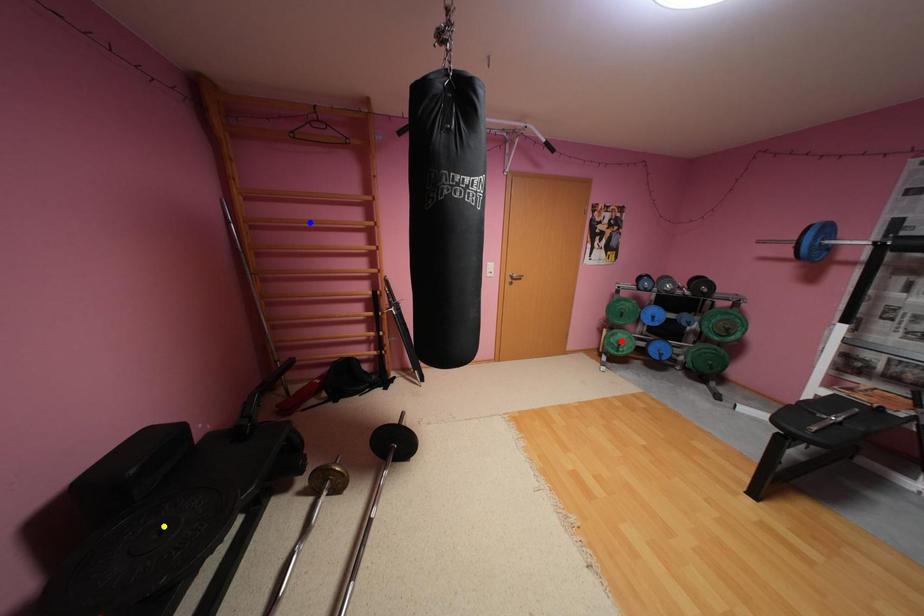
Order these from nearest to farthest:
- yellow point
- blue point
- red point

yellow point < blue point < red point